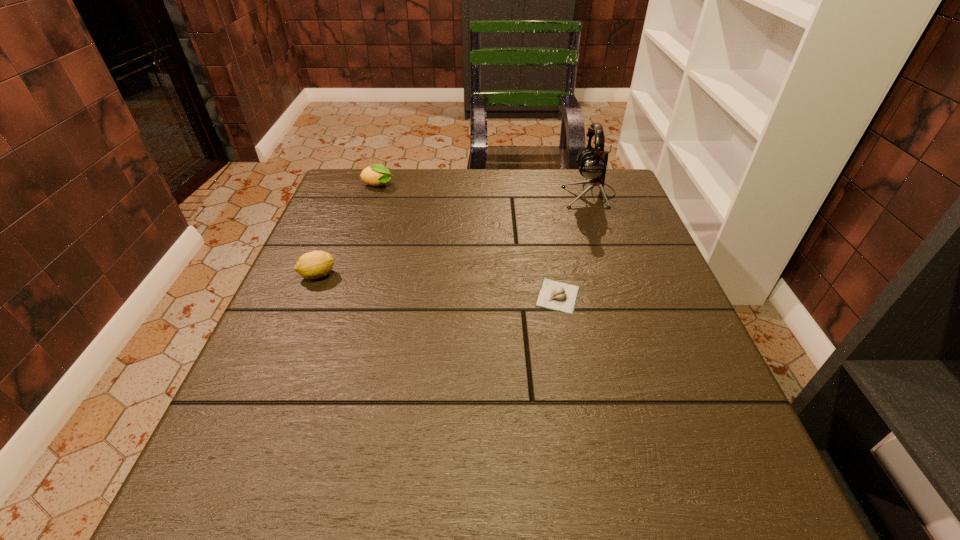
Where is `vacant space that satisfies the following two spatial constraints: 1. with leaves positioned above the rightmost object; 2. on the right side of the farther lemon`? vacant space that satisfies the following two spatial constraints: 1. with leaves positioned above the rightmost object; 2. on the right side of the farther lemon is located at coordinates (375, 194).

Locate an element on the screen. This screenshot has height=540, width=960. vacant point that satisfies the following two spatial constraints: 1. at the stem end of the nearer lemon; 2. on the left side of the shortest object is located at coordinates (309, 296).

I want to click on vacant space that satisfies the following two spatial constraints: 1. with leaves positioned above the second object from right to left; 2. on the right side of the farther lemon, so click(x=342, y=296).

The image size is (960, 540). What are the coordinates of `vacant space that satisfies the following two spatial constraints: 1. with leaves positioned above the farther lemon; 2. on the right side of the third object from left to right` in the screenshot? It's located at (342, 296).